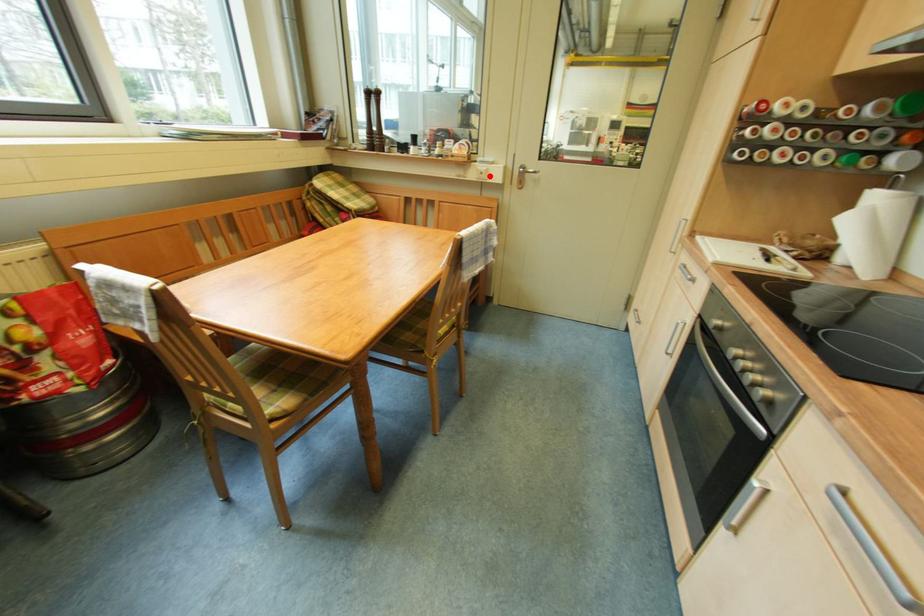
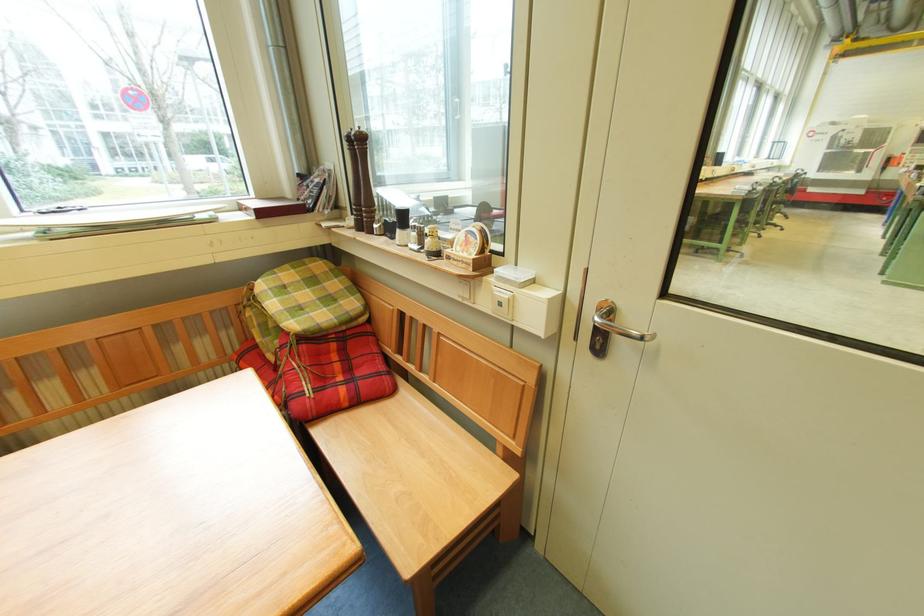
The point at the highlighted location is marked in the first image. Where is the corresponding point in the second image?

(507, 307)